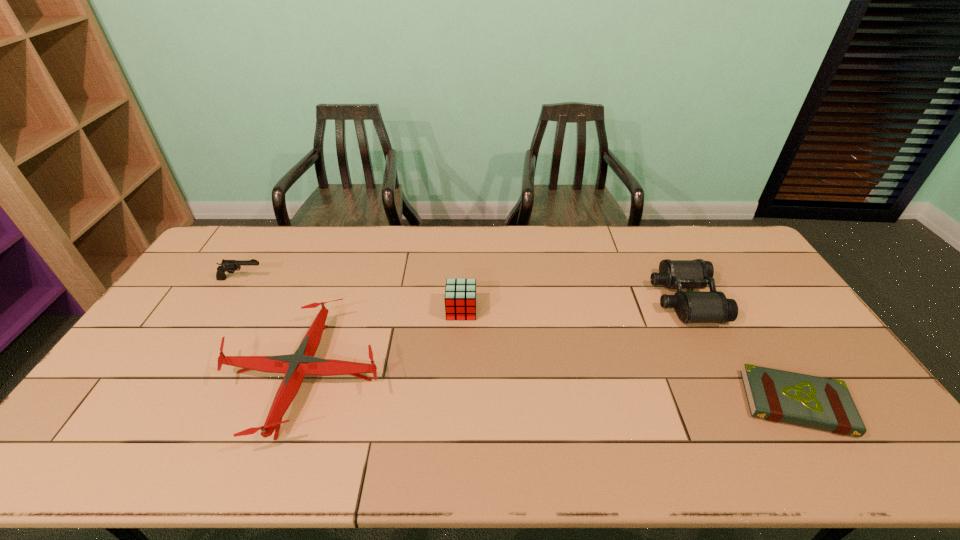
Identify the location of object that stands as the third closest to the binoculars. Image resolution: width=960 pixels, height=540 pixels. (295, 366).

Where is `free space that satisfies the following two spatial constraints: 1. through the eyepieces of the binoculars; 2. on the right side of the shortest object`? Image resolution: width=960 pixels, height=540 pixels. free space that satisfies the following two spatial constraints: 1. through the eyepieces of the binoculars; 2. on the right side of the shortest object is located at coordinates (737, 403).

Where is `vacant space that satisfies the following two spatial constraints: 1. on the front side of the shortest object; 2. on the left side of the fourth object from right to left`? This screenshot has width=960, height=540. vacant space that satisfies the following two spatial constraints: 1. on the front side of the shortest object; 2. on the left side of the fourth object from right to left is located at coordinates (294, 403).

The image size is (960, 540). I want to click on vacant space that satisfies the following two spatial constraints: 1. at the end of the barrel of the leftmost object; 2. on the back side of the drone, so click(x=181, y=376).

This screenshot has width=960, height=540. I want to click on free spot that satisfies the following two spatial constraints: 1. through the eyepieces of the binoculars; 2. on the right side of the shortest object, so click(737, 403).

This screenshot has width=960, height=540. In order to click on free spot that satisfies the following two spatial constraints: 1. on the front side of the drone; 2. on the right side of the shortest object in this screenshot , I will do `click(294, 403)`.

This screenshot has height=540, width=960. Find the location of `free location that satisfies the following two spatial constraints: 1. at the end of the barrel of the leftmost object; 2. on the right side of the third object from left to right`. free location that satisfies the following two spatial constraints: 1. at the end of the barrel of the leftmost object; 2. on the right side of the third object from left to right is located at coordinates (222, 310).

Find the location of a particular element. vacant region that satisfies the following two spatial constraints: 1. through the eyepieces of the binoculars; 2. on the left side of the shortest object is located at coordinates (737, 403).